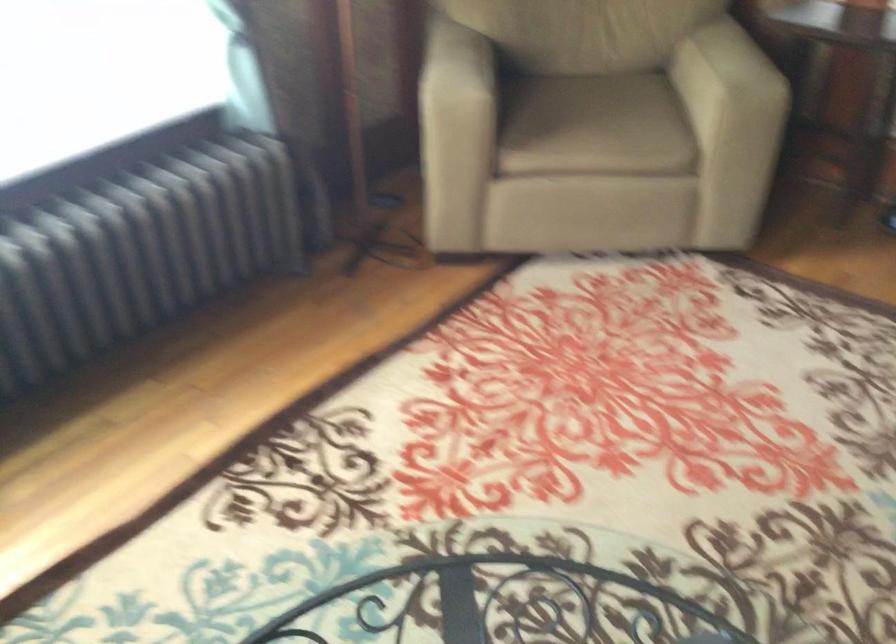
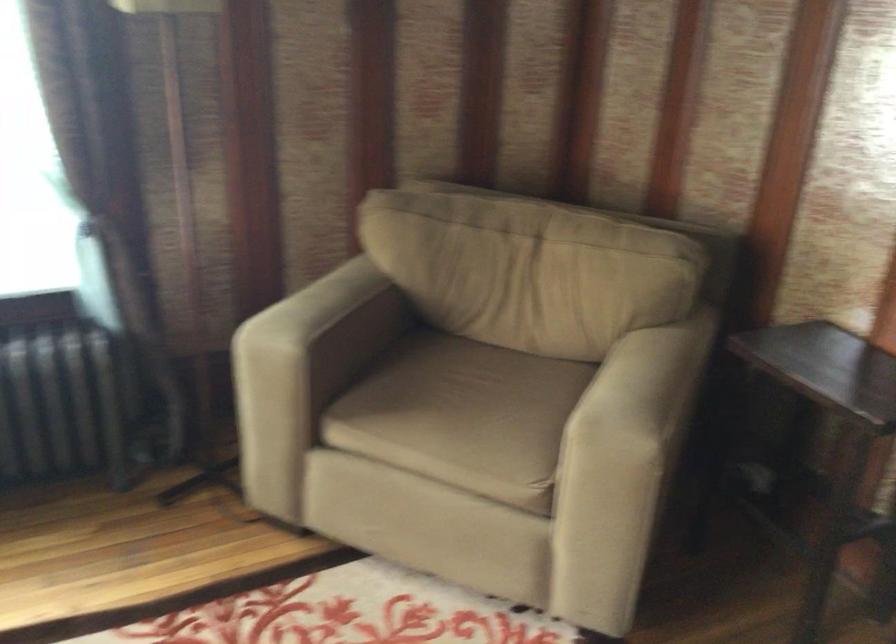
Find the pixel in the second image that matches (x=597, y=120) in the first image.

(458, 413)